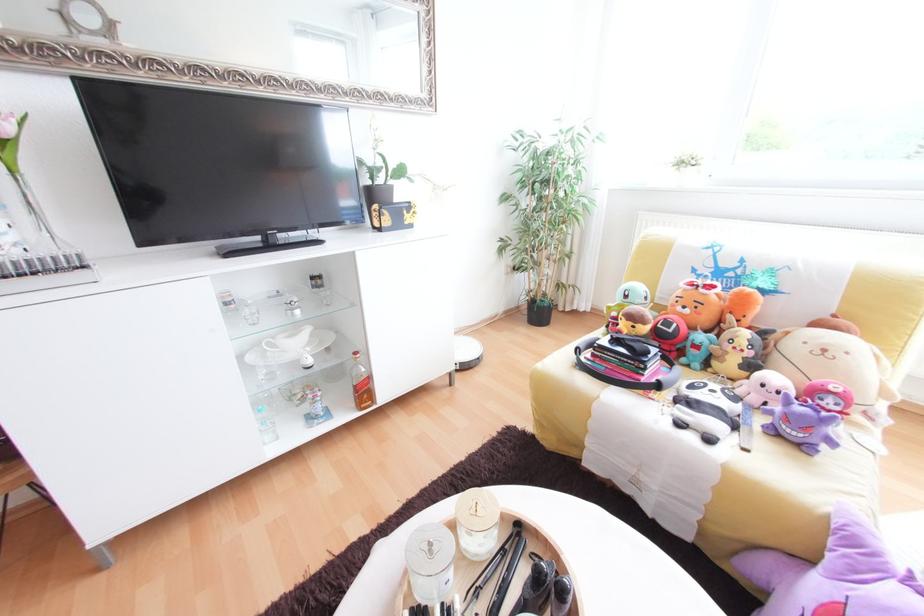
Image resolution: width=924 pixels, height=616 pixels. Find the location of `blue plush toy`. blue plush toy is located at coordinates (695, 350).